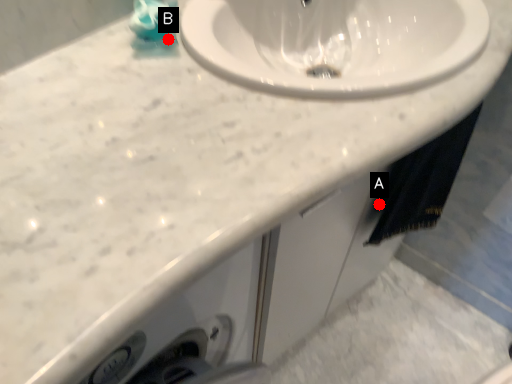
Question: Two points are circled on the image, labeled by A and B beside each circle. Which point is closer to the camera?

Choices:
 (A) A is closer
 (B) B is closer

Answer: (B)